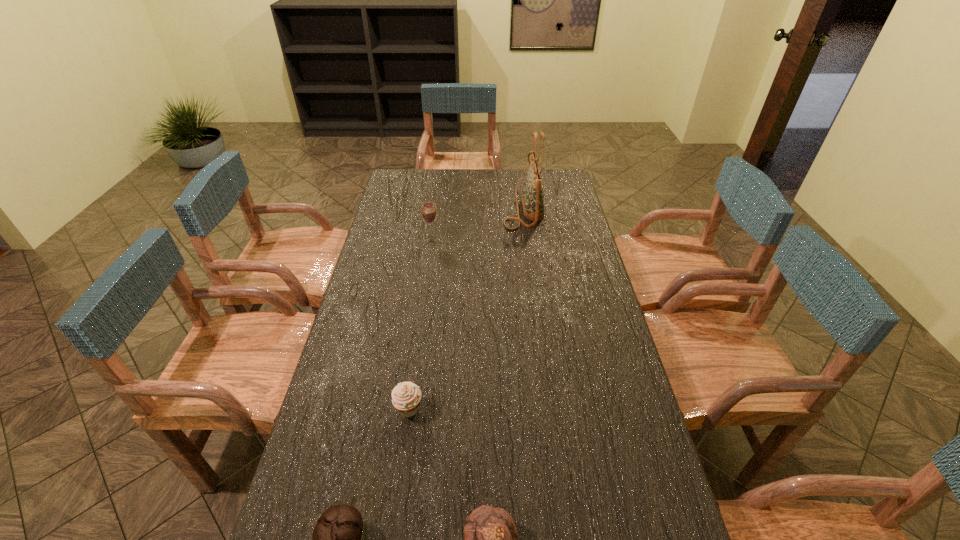
Image resolution: width=960 pixels, height=540 pixels. I want to click on free space located on the right of the third nearest object, so click(x=449, y=410).

Locate an element on the screen. This screenshot has width=960, height=540. object that is at the far edge is located at coordinates (533, 197).

What are the coordinates of `object located in the right edge section of the desktop` in the screenshot? It's located at (533, 197).

Identify the location of object located at the far right corner. (533, 197).

I want to click on vacant space at the far edge, so click(x=517, y=187).

Identify the location of free space at the left edge of the desktop. This screenshot has width=960, height=540. (368, 353).

Image resolution: width=960 pixels, height=540 pixels. What are the coordinates of `vacant position at the right edge of the desktop` in the screenshot? It's located at (597, 394).

Locate an element on the screen. This screenshot has width=960, height=540. vacant region at the far left corner of the desktop is located at coordinates (398, 188).

Locate an element on the screen. This screenshot has height=540, width=960. free space at the far right corner of the desktop is located at coordinates 548,181.

Locate an element on the screen. The height and width of the screenshot is (540, 960). free space between the third nearest object and the wineglass is located at coordinates (420, 325).